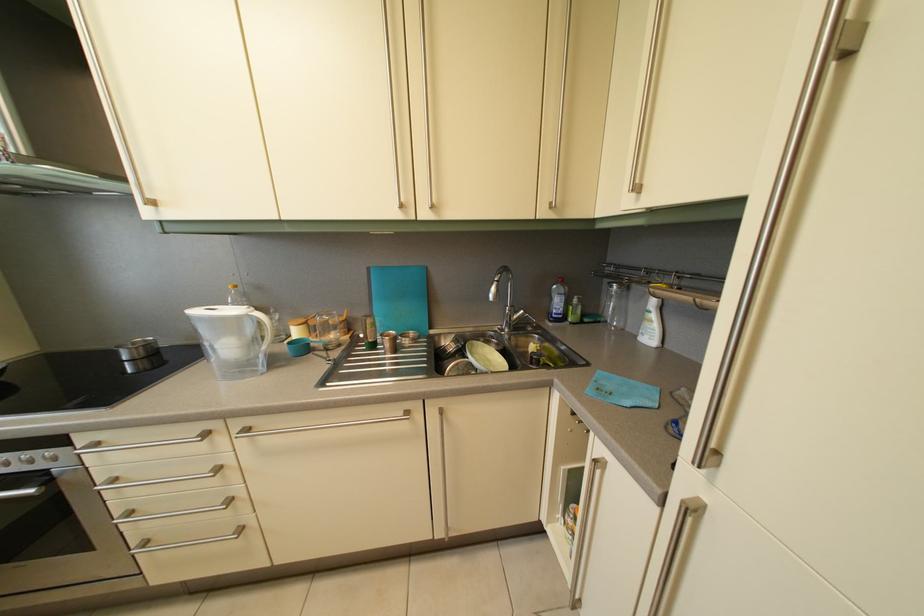
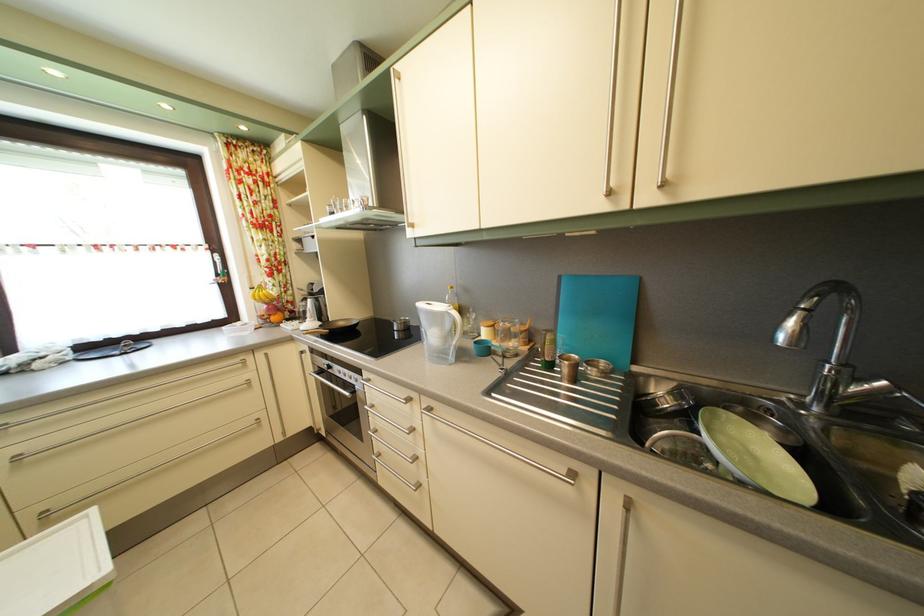
Find the pixel in the second image that matches (x=124, y=488) in the first image.

(381, 414)